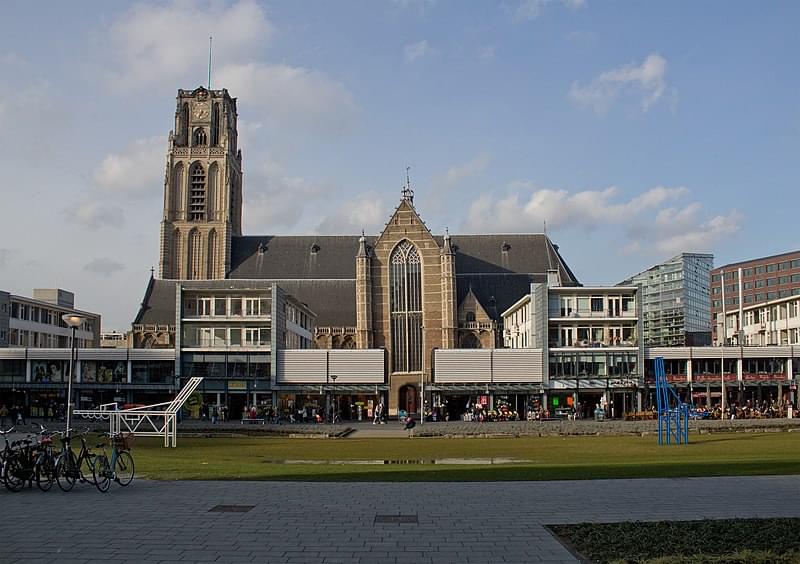
At what (x,y) coordinates should I click in order to perform the action: click on window. Please return your answer as a coordinate pair (x, y). Image resolution: width=800 pixels, height=564 pixels. Looking at the image, I should click on (409, 292).